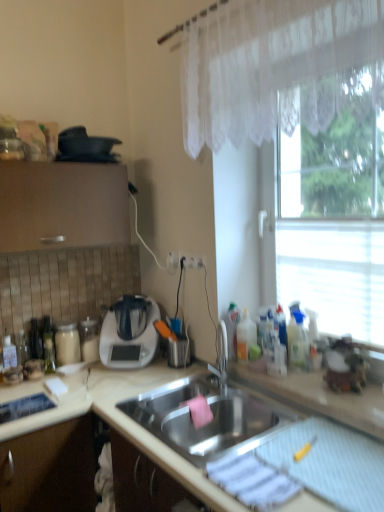
Question: Can you confirm if stainless steel sink at center is taller than white lace curtain at upper right?

Choices:
 (A) yes
 (B) no

Answer: (B)

Question: Is the position of stainless steel sink at center less distant than that of white lace curtain at upper right?

Choices:
 (A) yes
 (B) no

Answer: (B)

Question: Is stainless steel sink at center in contact with white lace curtain at upper right?

Choices:
 (A) yes
 (B) no

Answer: (B)

Question: Is stainless steel sink at center shorter than white lace curtain at upper right?

Choices:
 (A) no
 (B) yes

Answer: (B)

Question: Is stainless steel sink at center bigger than white lace curtain at upper right?

Choices:
 (A) yes
 (B) no

Answer: (B)

Question: Is black matte pan at upper left, marked as the 2th appliance in a bottom-to-top arrangement, bigger or smaller than beige matte countertop at center?

Choices:
 (A) small
 (B) big

Answer: (A)

Question: Is black matte pan at upper left, marked as the 1th appliance in a top-to-bottom arrangement, wider or thinner than beige matte countertop at center?

Choices:
 (A) wide
 (B) thin

Answer: (B)

Question: Is point (92, 160) positioned closer to the camera than point (289, 398)?

Choices:
 (A) closer
 (B) farther

Answer: (B)

Question: From the image's perspective, is black matte pan at upper left, marked as the 1th appliance in a top-to-bottom arrangement, located above or below beige matte countertop at center?

Choices:
 (A) above
 (B) below

Answer: (A)

Question: Considering their positions, is stainless steel sink at center located in front of or behind transparent glass window at right?

Choices:
 (A) behind
 (B) front

Answer: (B)

Question: Is stainless steel sink at center wider or thinner than transparent glass window at right?

Choices:
 (A) thin
 (B) wide

Answer: (A)

Question: Considering the positions of point (160, 436) and point (336, 303), is point (160, 436) closer or farther from the camera than point (336, 303)?

Choices:
 (A) farther
 (B) closer

Answer: (B)

Question: From their relative heights in the image, would you say stainless steel sink at center is taller or shorter than transparent glass window at right?

Choices:
 (A) tall
 (B) short

Answer: (B)

Question: Considering the positions of white lace curtain at upper right and transparent glass window at right in the image, is white lace curtain at upper right wider or thinner than transparent glass window at right?

Choices:
 (A) wide
 (B) thin

Answer: (B)

Question: Considering their positions, is white lace curtain at upper right located in front of or behind transparent glass window at right?

Choices:
 (A) front
 (B) behind

Answer: (A)